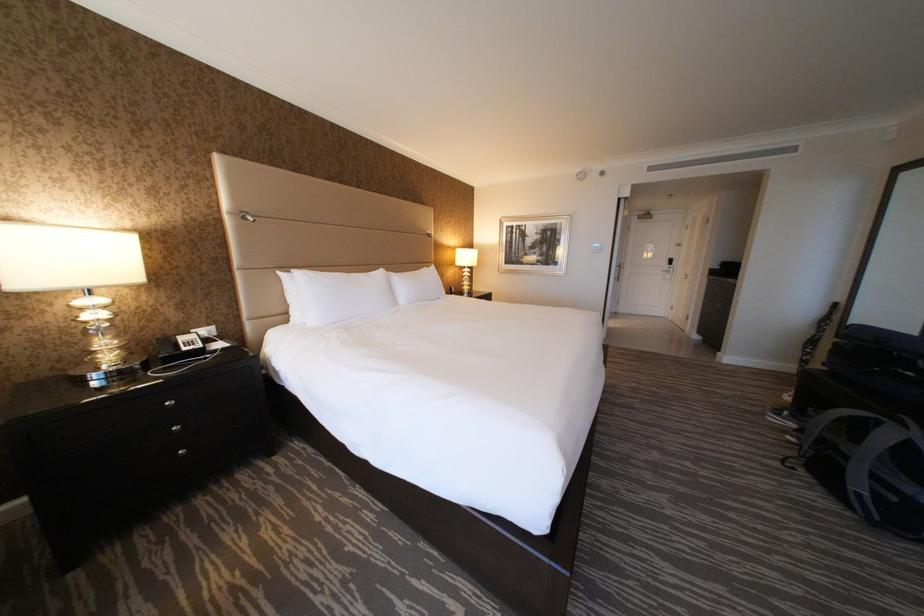
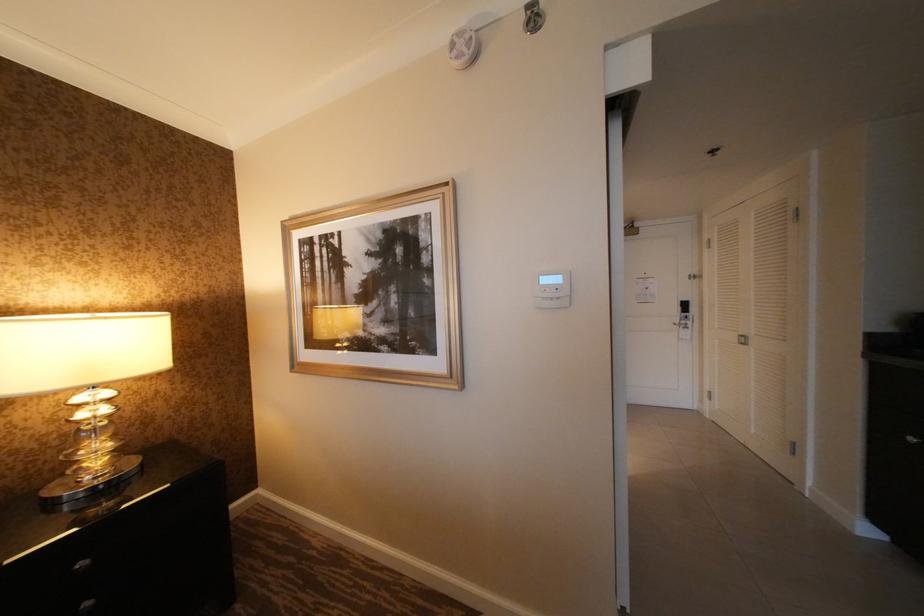
Which direction would the cameraman need to move to produce the second image?

The cameraman moved toward right, forward.